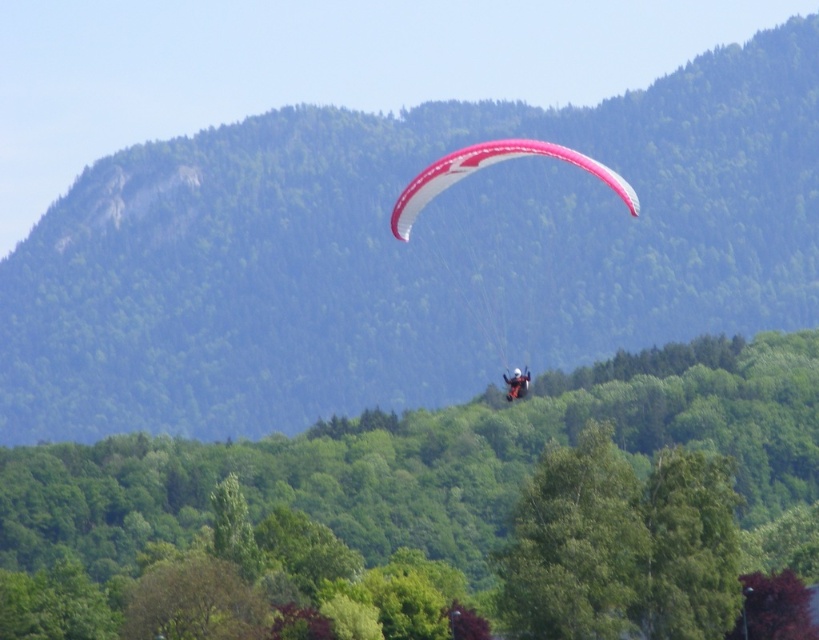
Can you confirm if green leafy hillside at center is positioned to the left of white matte parachute at upper center?

Indeed, green leafy hillside at center is positioned on the left side of white matte parachute at upper center.

What are the coordinates of `green leafy hillside at center` in the screenshot? It's located at (410, 253).

I want to click on green leafy hillside at center, so click(x=410, y=253).

Is pink fabric parachute at center to the left of white matte parachute at upper center from the viewer's perspective?

Yes, pink fabric parachute at center is to the left of white matte parachute at upper center.

Between pink fabric parachute at center and white matte parachute at upper center, which one is positioned higher?

Positioned higher is pink fabric parachute at center.

Between point (433, 163) and point (510, 378), which one is positioned in front?

Point (510, 378)

Find the location of `pink fabric parachute at center`. pink fabric parachute at center is located at coordinates (491, 164).

Does green leafy hillside at center come behind pink fabric parachute at center?

Yes, green leafy hillside at center is behind pink fabric parachute at center.

Which is below, green leafy hillside at center or pink fabric parachute at center?

Positioned lower is green leafy hillside at center.

What are the coordinates of `green leafy hillside at center` in the screenshot? It's located at (410, 253).